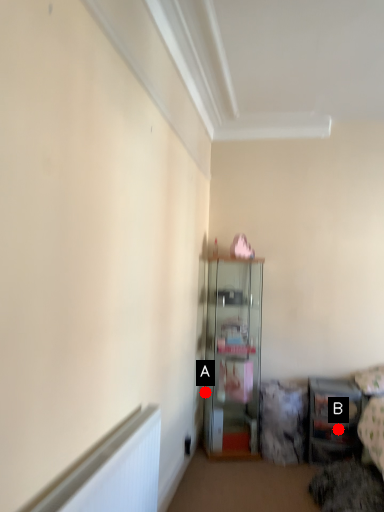
Question: Two points are circled on the image, labeled by A and B beside each circle. Which of the following is the closest to the observer?

Choices:
 (A) A is closer
 (B) B is closer

Answer: (B)